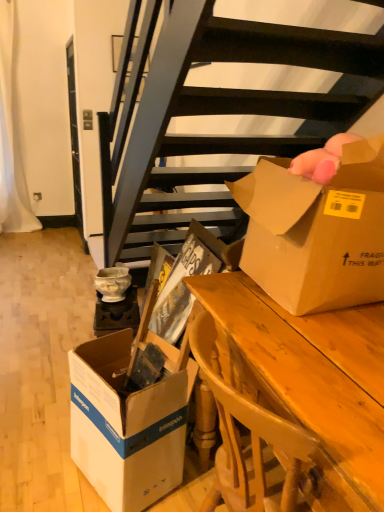
Question: Is cardboard box at center wider or thinner than white cardboard box at lower left, which is the 2th box in right-to-left order?

Choices:
 (A) thin
 (B) wide

Answer: (B)

Question: Relative to white cardboard box at lower left, which is the 2th box in right-to-left order, is cardboard box at center in front or behind?

Choices:
 (A) front
 (B) behind

Answer: (B)

Question: Which object is positioned farthest from the white cardboard box at lower left, positioned as the 1th box in bottom-to-top order?

Choices:
 (A) cardboard box at center
 (B) brown cardboard box at upper right, the second box in the left-to-right sequence
 (C) wooden desk at center

Answer: (B)

Question: Considering the real-world distances, which object is farthest from the brown cardboard box at upper right, positioned as the 1th box in right-to-left order?

Choices:
 (A) cardboard box at center
 (B) wooden desk at center
 (C) white cardboard box at lower left, which is the 2th box in right-to-left order

Answer: (C)